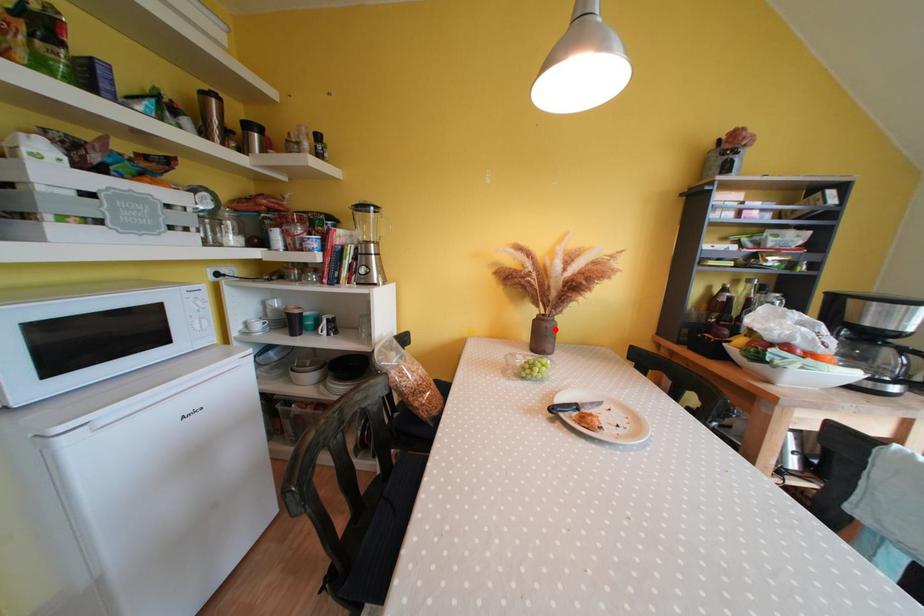
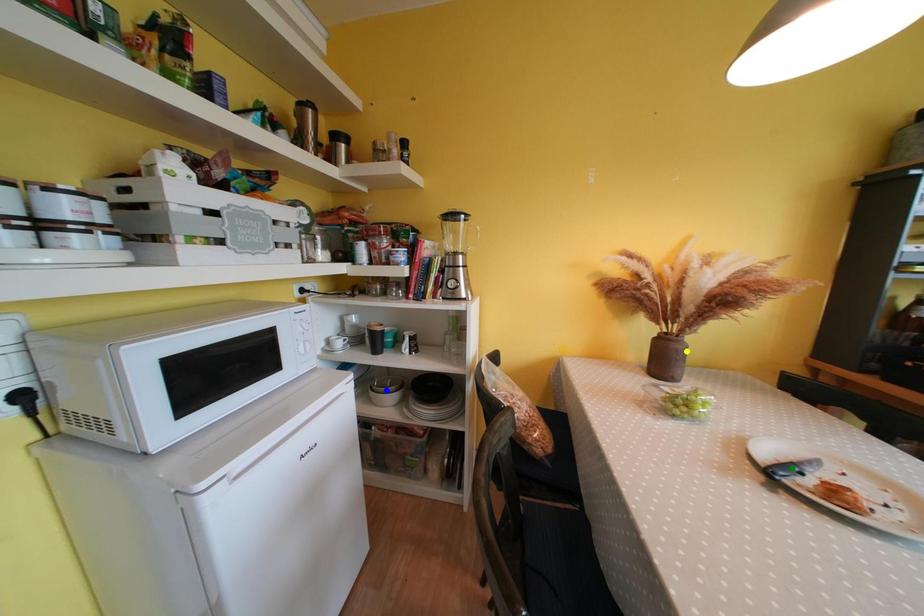
Question: I am providing you with two images of the same scene from different viewpoints. A red point is marked on the first image. You are given multiple points on the second image. Which point in image 2 is actually the same real-world point as the red point in image 1?

Choices:
 (A) blue point
 (B) yellow point
 (C) green point

Answer: (B)